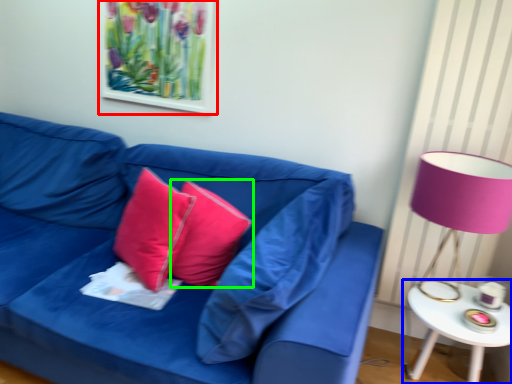
Question: Estimate the real-world distances between objects in this image. Which object is closer to picture frame (highlighted by a red box), table (highlighted by a blue box) or pillow (highlighted by a green box)?

Choices:
 (A) table
 (B) pillow

Answer: (B)